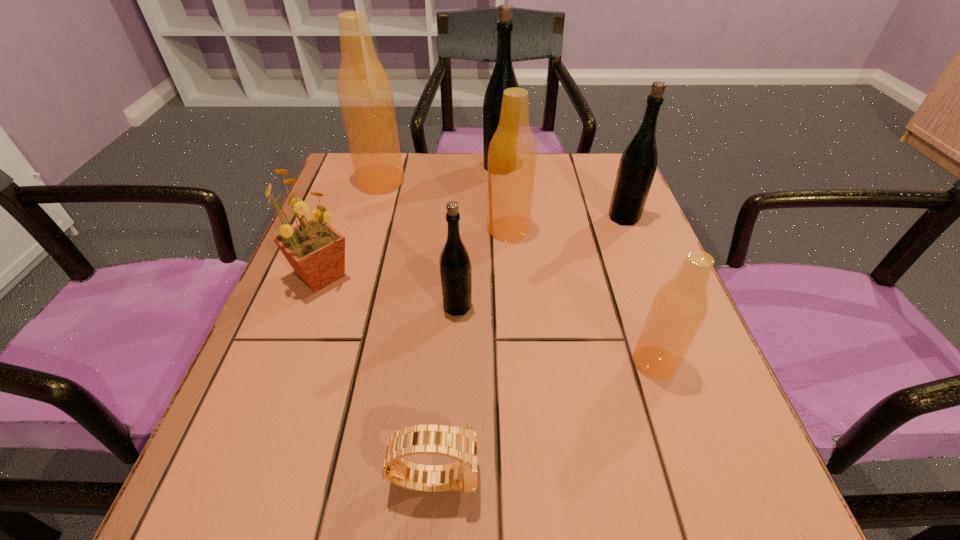
Identify which tan beer bottle is located as the nearest to the farthest green beer bottle. Please provide its 2D coordinates. Your answer should be formatted as a tuple, i.e. [(x, y)], where the tuple contains the x and y coordinates of a point satisfying the conditions above.

[(512, 155)]

Identify the location of vacant space that satisfies the following two spatial constraints: 1. at the front of the sunflower with flowers visible; 2. on the left side of the fifth farthest beer bottle. (310, 306).

Where is `vacant space that satisfies the following two spatial constraints: 1. on the front side of the nearest green beer bottle; 2. on the face of the shortest object`? vacant space that satisfies the following two spatial constraints: 1. on the front side of the nearest green beer bottle; 2. on the face of the shortest object is located at coordinates (449, 477).

Locate an element on the screen. The height and width of the screenshot is (540, 960). vacant space that satisfies the following two spatial constraints: 1. on the front side of the second nearest tan beer bottle; 2. on the right side of the farthest green beer bottle is located at coordinates (504, 229).

Image resolution: width=960 pixels, height=540 pixels. I want to click on free spot that satisfies the following two spatial constraints: 1. on the front side of the farthest tan beer bottle; 2. on the left side of the nearest tan beer bottle, so click(x=327, y=362).

At what (x,y) coordinates should I click in order to perform the action: click on free location that satisfies the following two spatial constraints: 1. at the front of the sunflower with flowers visible; 2. on the right side of the nearest tan beer bottle. Please return your answer as a coordinate pair (x, y). The height and width of the screenshot is (540, 960). Looking at the image, I should click on (289, 362).

The image size is (960, 540). What are the coordinates of `free location that satisfies the following two spatial constraints: 1. on the front side of the leftmost tan beer bottle; 2. on the right side of the second tan beer bottle from left to right` in the screenshot? It's located at point(367,229).